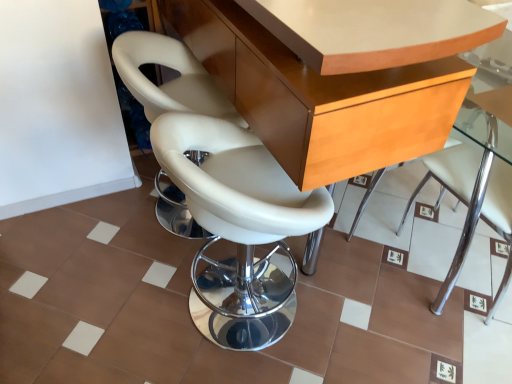
At what (x,y) coordinates should I click in order to perform the action: click on vacant area situated to the left side of white leather chair at center, arranged as the 2th chair when viewed from the right. Please return your answer as a coordinate pair (x, y). Looking at the image, I should click on (118, 302).